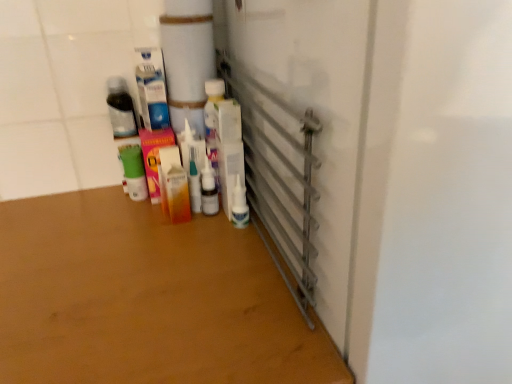
Locate an element on the screen. free point above brown wood counter top at center (from a real-world perspective) is located at coordinates (120, 264).